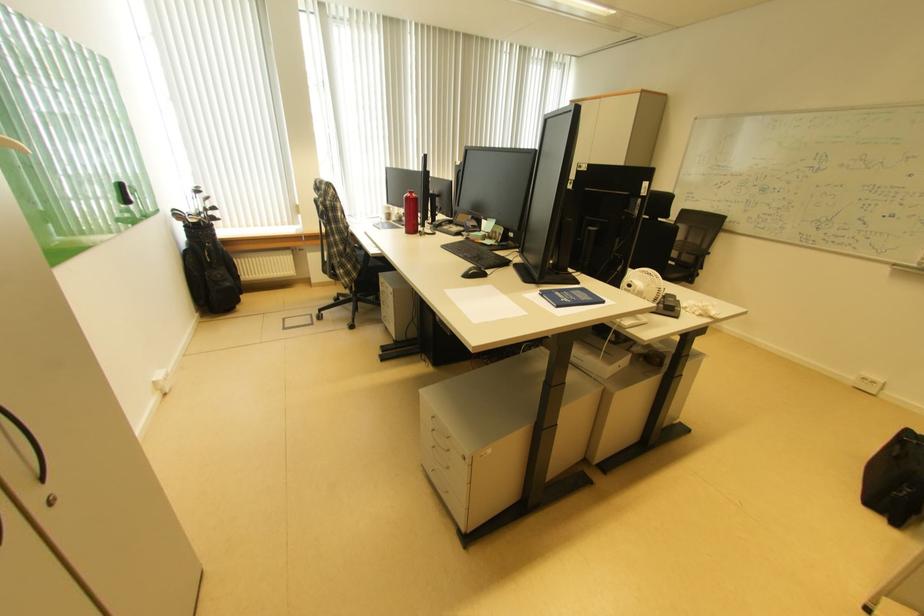
Find where to lift the white paper sheet. Please return your answer as a coordinate pair (x, y).

(481, 302)